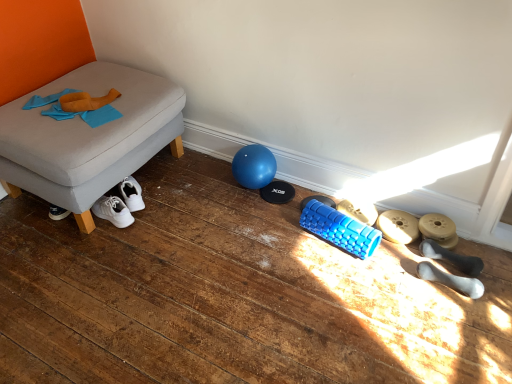
Image resolution: width=512 pixels, height=384 pixels. What are the coordinates of `empty space that is to the right of matte gold dumbbell at lower right, positioned as the 3th footwear in back-to-front order` in the screenshot? It's located at (480, 255).